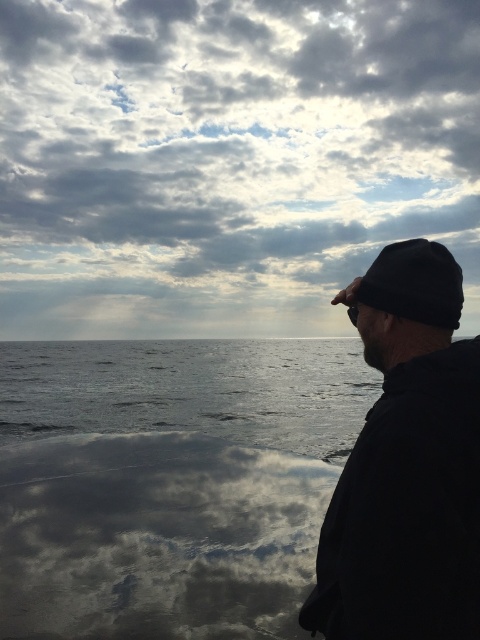
You are a photographer planning to take a photo of the cloudy sky at upper center and the black matte beanie at right. Based on their positions, which object would appear higher in the frame?

The cloudy sky at upper center is located above the black matte beanie at right, so it would appear higher in the frame.

You are a photographer planning to take a portrait of someone wearing a black matte beanie at right against the cloudy sky at upper center. Based on the scene, will the beanie be taller or shorter than the sky in the photo?

The cloudy sky at upper center is taller than the black matte beanie at right, so the sky will appear taller in the photo.

You are standing at the coast looking at the sky and ocean. There are two points marked in the image. The first point is at coordinates point (183, 19) and the second is at point (445, 368). Which point is closer to you?

Point (183, 19) is closer to you because it is further to the viewer than point (445, 368).